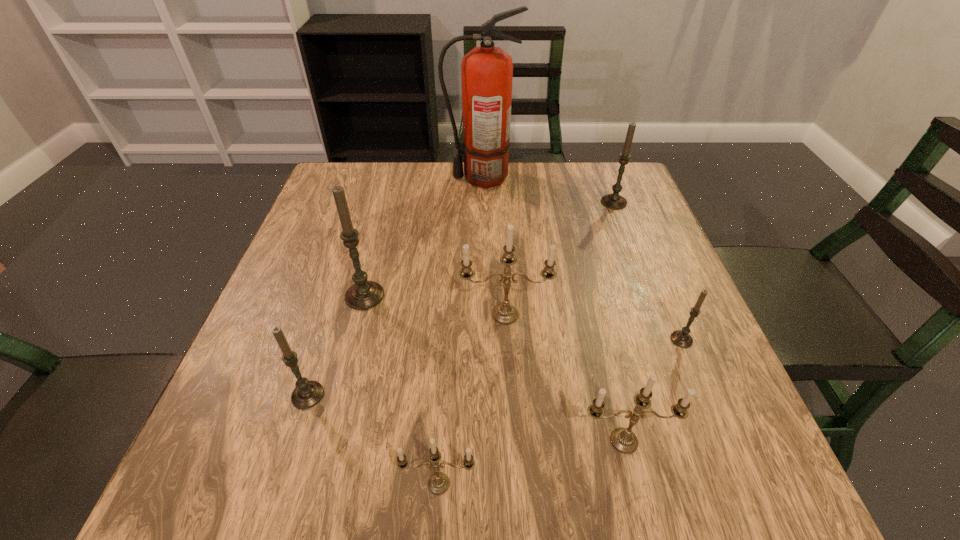
The image size is (960, 540). Find the location of `the sixth farthest candle`. the sixth farthest candle is located at coordinates (622, 439).

Where is `the smallest gray candle`? The image size is (960, 540). the smallest gray candle is located at coordinates (680, 338).

Where is `the fifth farthest object`? This screenshot has height=540, width=960. the fifth farthest object is located at coordinates (680, 338).

Image resolution: width=960 pixels, height=540 pixels. I want to click on the nearest object, so click(x=438, y=483).

Locate an element on the screen. Image resolution: width=960 pixels, height=540 pixels. the nearest candle is located at coordinates (438, 483).

At what (x,y) coordinates should I click in order to perform the action: click on vacant space located 0.160m on the nozzle of the farthest object. Please return your answer as a coordinate pair (x, y). Looking at the image, I should click on (389, 178).

Identify the location of vacant space located on the nozzle of the farthest object. This screenshot has width=960, height=540. (417, 178).

Locate an element on the screen. vacant area located 0.190m on the nozzle of the farthest object is located at coordinates (378, 178).

At what (x,y) coordinates should I click in order to perform the action: click on vacant space located on the front of the biggest gray candle. Please return your answer as a coordinate pair (x, y). Image resolution: width=960 pixels, height=540 pixels. Looking at the image, I should click on click(x=339, y=398).

This screenshot has height=540, width=960. I want to click on free region located 0.120m on the back of the farthest gray candle, so click(x=602, y=172).